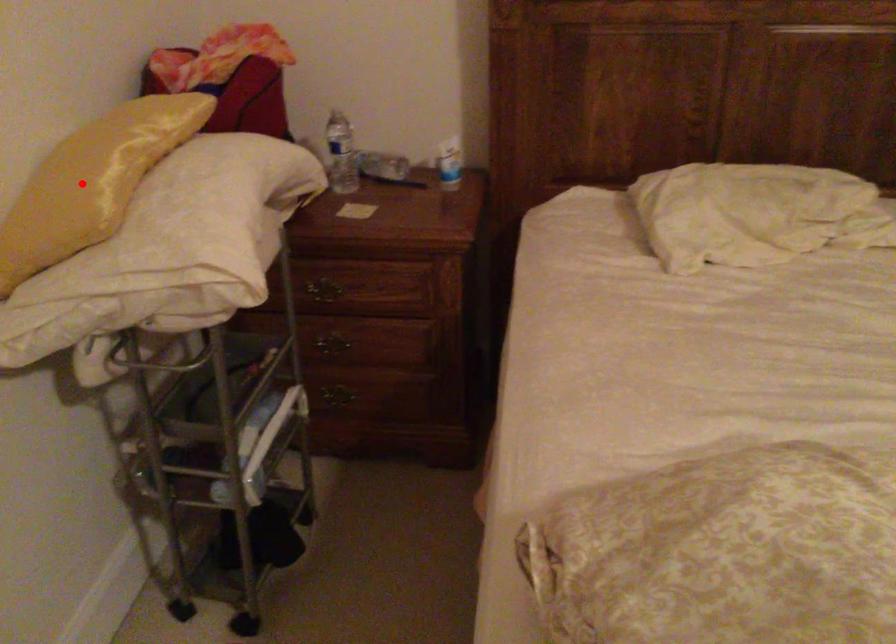
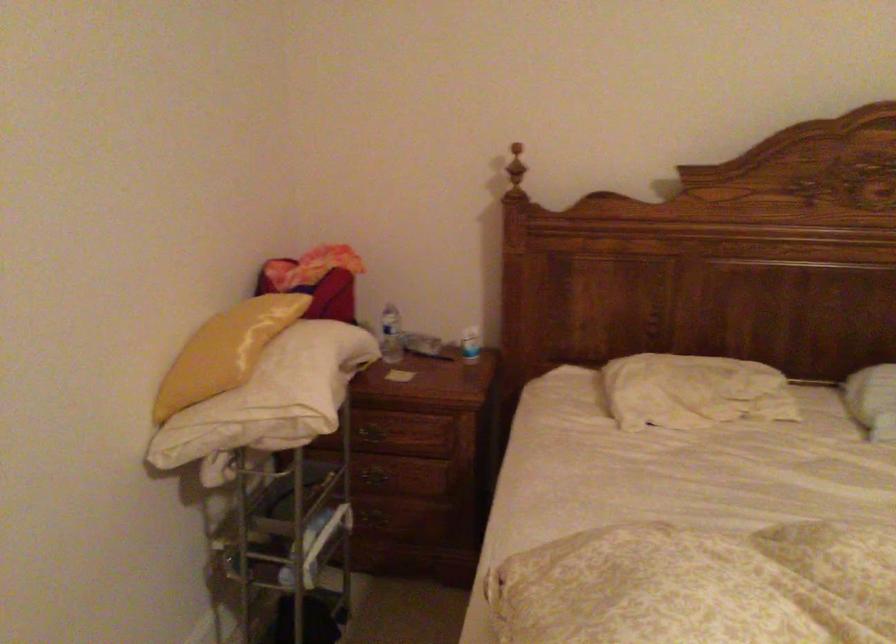
Where in the second image is the point corresponding to the highlighted location from the first image?

(225, 351)